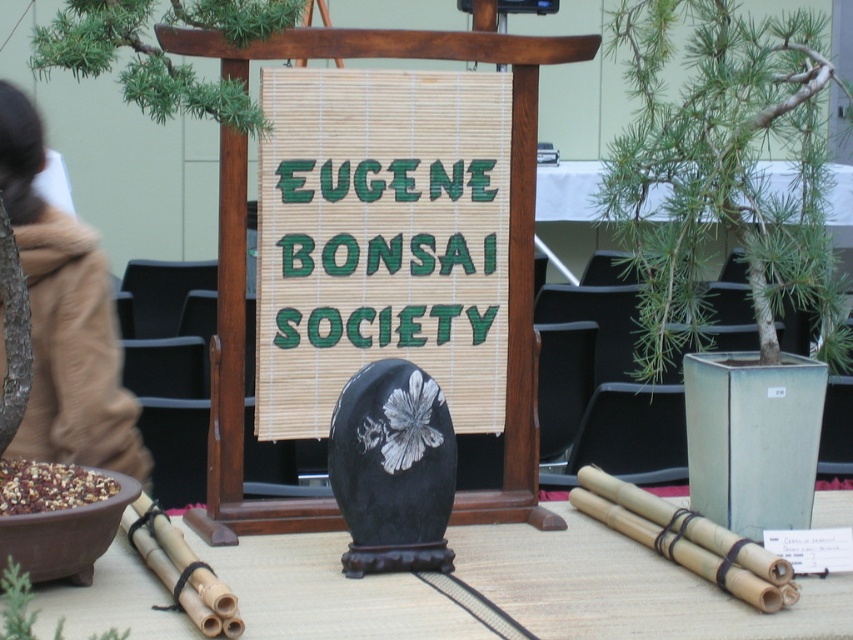
You are a visitor at the bonsai exhibition and want to take a photo of both the green leafy bonsai at right and the green matte bamboo at lower left. Which object should you focus on first if you want to ensure both are in frame without moving the camera?

The green leafy bonsai at right is taller than the green matte bamboo at lower left, so you should focus on the green leafy bonsai at right first to ensure it fits in the frame, then adjust to include the shorter bamboo.

You are a visitor at the bonsai exhibition and want to take a photo of the green leafy bonsai at right and the smooth bamboo sticks at center. Which object should you focus on first if you want to capture both in a single frame without moving your camera?

The green leafy bonsai at right is taller than the smooth bamboo sticks at center, so you should focus on the taller bonsai first to ensure it fits within the frame.

You are an attendee at the Eugene Bonsai Society exhibition. You see a green leafy tree at upper left and a green matte bamboo at lower left. Which object is located to the right of the other?

The green leafy tree at upper left is positioned on the right side of green matte bamboo at lower left.